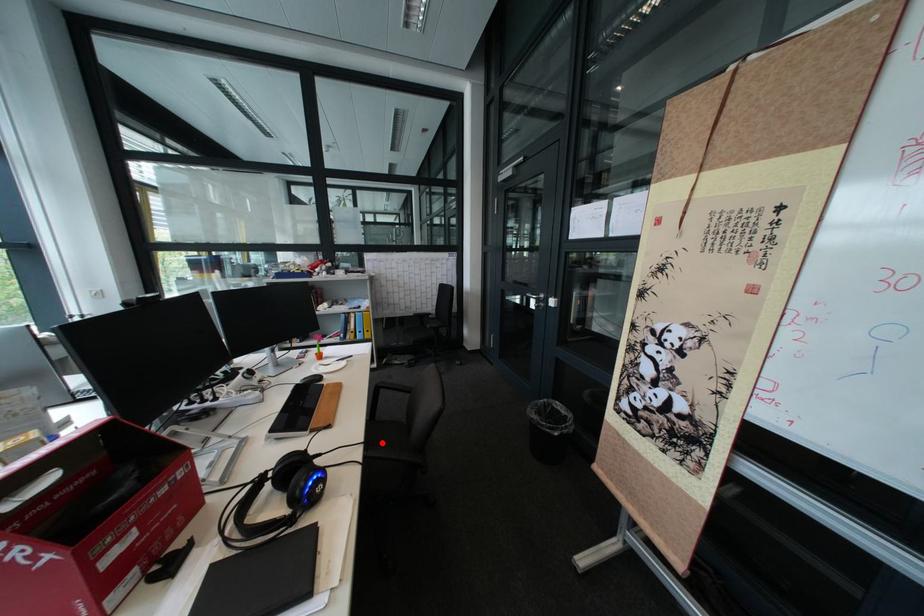
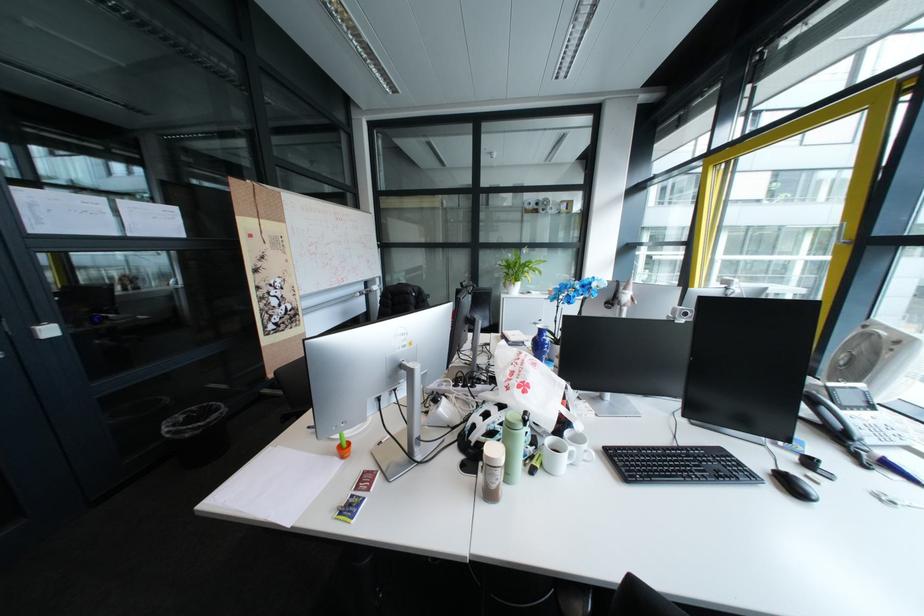
Question: I am providing you with two images of the same scene from different viewpoints. A red point is marked on the first image. Can you still see the location of the red point in image 2?

Choices:
 (A) Yes
 (B) No

Answer: (B)